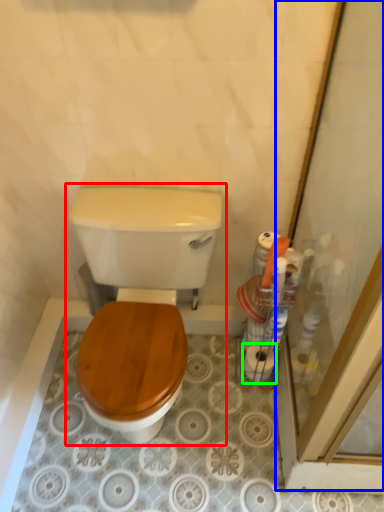
Question: Which object is the closest to the toilet (highlighted by a red box)? Choose among these: screen door (highlighted by a blue box) or toilet paper (highlighted by a green box).

Choices:
 (A) screen door
 (B) toilet paper

Answer: (A)